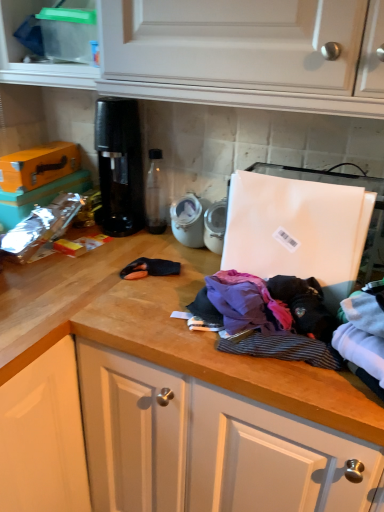
Question: Which direction should I rotate to face striped cotton shirt at center, which ranks as the second clothing in left-to-right order, — up or down?

Choices:
 (A) down
 (B) up

Answer: (A)

Question: Is white cotton socks at lower right, placed as the first clothing when sorted from right to left, positioned with its back to purple cotton shirt at center, arranged as the third clothing when viewed from the left?

Choices:
 (A) yes
 (B) no

Answer: (B)

Question: From a real-world perspective, is white cotton socks at lower right, which ranks as the 4th clothing in left-to-right order, on top of purple cotton shirt at center, arranged as the third clothing when viewed from the left?

Choices:
 (A) yes
 (B) no

Answer: (B)

Question: Is the position of white cotton socks at lower right, placed as the first clothing when sorted from right to left, more distant than that of purple cotton shirt at center, the 2th clothing when ordered from right to left?

Choices:
 (A) yes
 (B) no

Answer: (B)

Question: Considering the relative positions of white cotton socks at lower right, placed as the first clothing when sorted from right to left, and purple cotton shirt at center, arranged as the third clothing when viewed from the left, in the image provided, is white cotton socks at lower right, placed as the first clothing when sorted from right to left, to the right of purple cotton shirt at center, arranged as the third clothing when viewed from the left, from the viewer's perspective?

Choices:
 (A) no
 (B) yes

Answer: (B)

Question: Considering the relative sizes of white cotton socks at lower right, which ranks as the 4th clothing in left-to-right order, and purple cotton shirt at center, the 2th clothing when ordered from right to left, in the image provided, is white cotton socks at lower right, which ranks as the 4th clothing in left-to-right order, taller than purple cotton shirt at center, the 2th clothing when ordered from right to left,?

Choices:
 (A) no
 (B) yes

Answer: (A)

Question: From the image's perspective, is white cotton socks at lower right, which ranks as the 4th clothing in left-to-right order, under purple cotton shirt at center, the 2th clothing when ordered from right to left?

Choices:
 (A) no
 (B) yes

Answer: (B)

Question: Is purple fabric at center, which is the fourth clothing in right-to-left order, surrounded by purple cotton shirt at center, the 2th clothing when ordered from right to left?

Choices:
 (A) no
 (B) yes

Answer: (A)

Question: Is purple fabric at center, which is the first clothing in left-to-right order, at the back of purple cotton shirt at center, the 2th clothing when ordered from right to left?

Choices:
 (A) yes
 (B) no

Answer: (B)

Question: From a real-world perspective, is purple cotton shirt at center, arranged as the third clothing when viewed from the left, located higher than purple fabric at center, which is the fourth clothing in right-to-left order?

Choices:
 (A) yes
 (B) no

Answer: (A)

Question: Does purple cotton shirt at center, the 2th clothing when ordered from right to left, have a larger size compared to purple fabric at center, which is the fourth clothing in right-to-left order?

Choices:
 (A) no
 (B) yes

Answer: (B)

Question: Can you confirm if purple cotton shirt at center, arranged as the third clothing when viewed from the left, is smaller than purple fabric at center, which is the fourth clothing in right-to-left order?

Choices:
 (A) no
 (B) yes

Answer: (A)

Question: From the image's perspective, is purple cotton shirt at center, the 2th clothing when ordered from right to left, on purple fabric at center, which is the first clothing in left-to-right order?

Choices:
 (A) no
 (B) yes

Answer: (A)

Question: From a real-world perspective, is clear plastic container at upper left below purple fabric at center, which is the fourth clothing in right-to-left order?

Choices:
 (A) no
 (B) yes

Answer: (A)